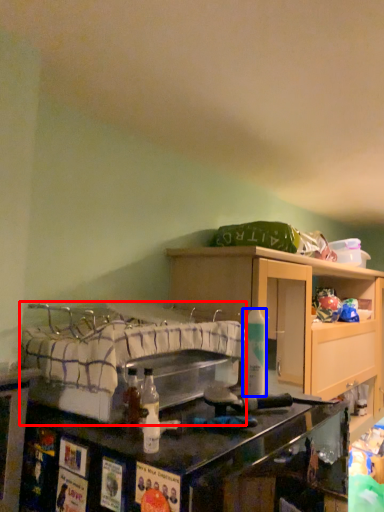
Question: Which object is closer to the camera taking this photo, bed (highlighted by a red box) or bottle (highlighted by a blue box)?

Choices:
 (A) bed
 (B) bottle

Answer: (A)